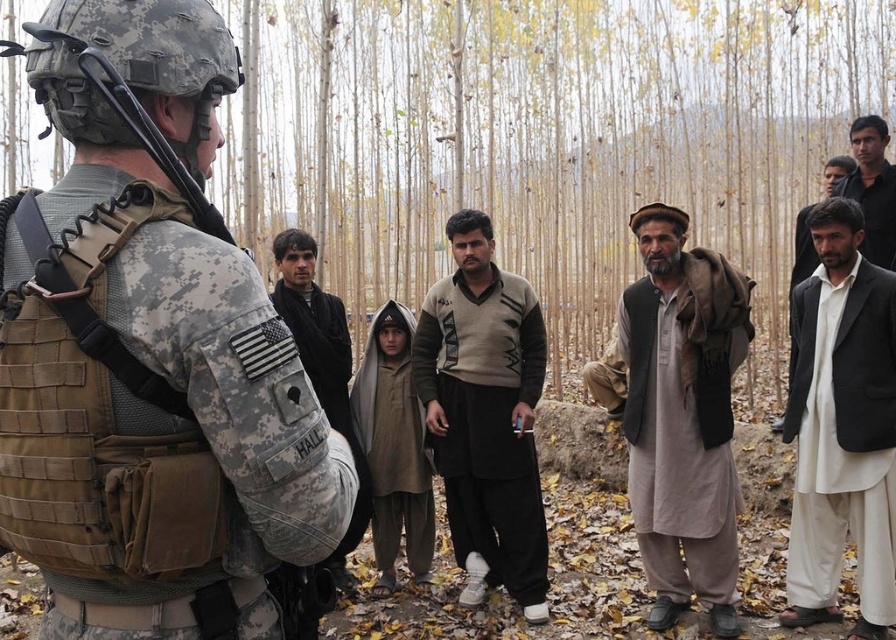
Question: Which is farther from the white cotton shirt at right?

Choices:
 (A) dark brown wool sweater at center
 (B) camouflage uniform at center
 (C) light brown woolen sweater at center

Answer: (B)

Question: Which of these objects is positioned farthest from the light brown woolen robe at center?

Choices:
 (A) light brown woolen sweater at center
 (B) white cotton shirt at right

Answer: (A)

Question: Is light brown woolen robe at center further to the viewer compared to dark brown wool sweater at center?

Choices:
 (A) yes
 (B) no

Answer: (A)

Question: Is light brown woolen robe at center further to the viewer compared to white cotton kurta at right?

Choices:
 (A) no
 (B) yes

Answer: (B)

Question: Which object is positioned closest to the light brown woolen robe at center?

Choices:
 (A) light brown woolen sweater at center
 (B) white cotton kurta at right

Answer: (B)

Question: Observing the image, what is the correct spatial positioning of dark brown wool sweater at center in reference to white cotton shirt at right?

Choices:
 (A) right
 (B) left

Answer: (B)